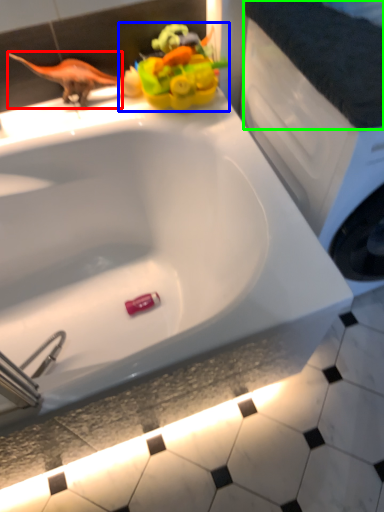
Question: Estimate the real-world distances between objects in this image. Which object is closer to animal (highlighted by a red box), toy (highlighted by a blue box) or counter top (highlighted by a green box)?

Choices:
 (A) toy
 (B) counter top

Answer: (A)